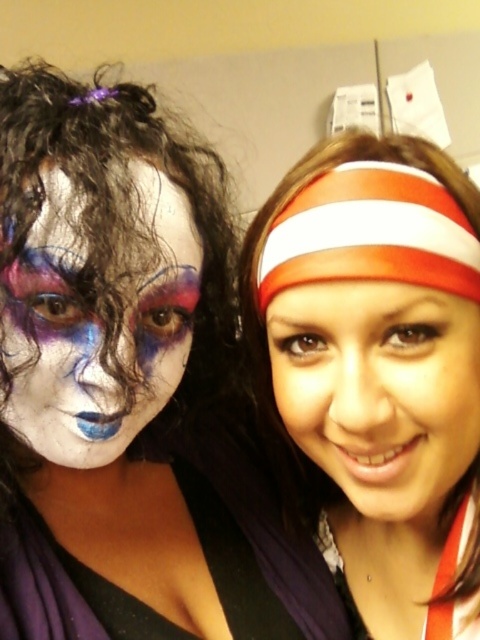
Based on the photo, you are standing in front of the two people in the image and want to take a photo of them. The camera you have can only focus on objects within 20 inches. Is the point at coordinate point [60,556] within the camera focus range?

The distance between point [60,556] and the viewer is 21.50 inches, which is beyond the camera focus range of 20 inches. Therefore, the camera cannot focus on that point.

You are a photographer adjusting the camera settings. The camera has a focus range of 5 inches. Can you focus on both the smooth skin face at center and the matte white face paint at left simultaneously?

The smooth skin face at center and the matte white face paint at left are 5.30 inches apart. Since the focus range is 5 inches, the camera cannot focus on both simultaneously because the distance between them exceeds the focus range.